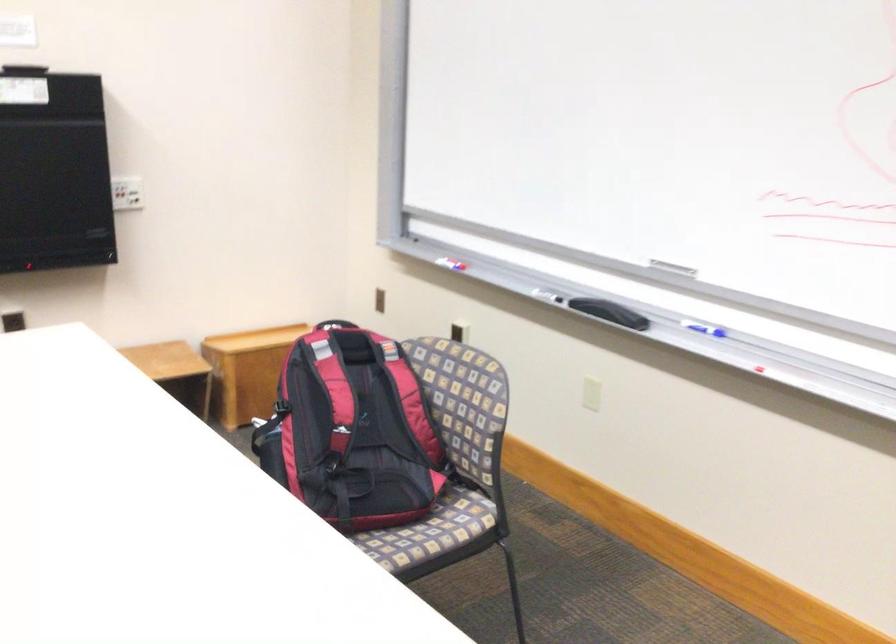
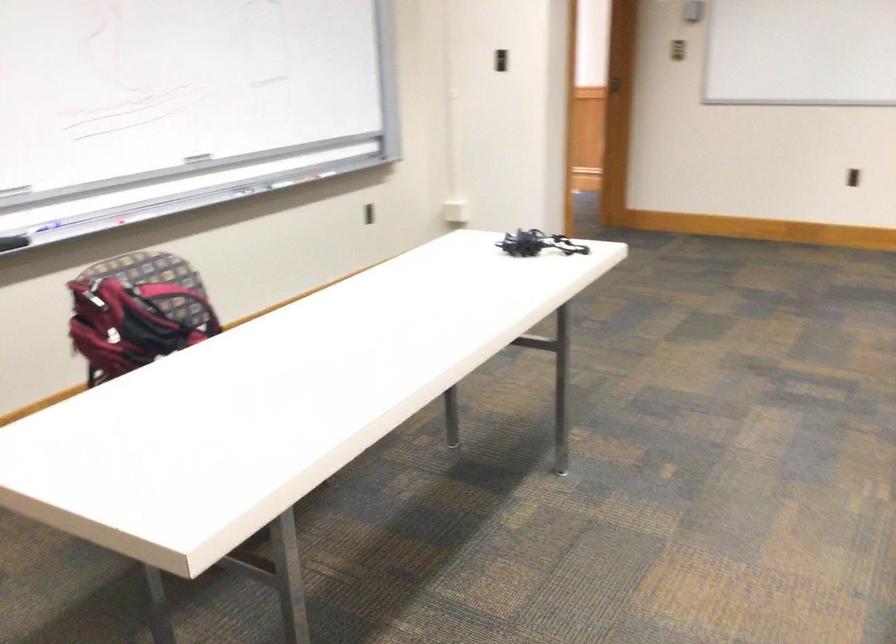
Locate, in the second image, the point that corresponds to point (686, 328) in the first image.

(39, 229)